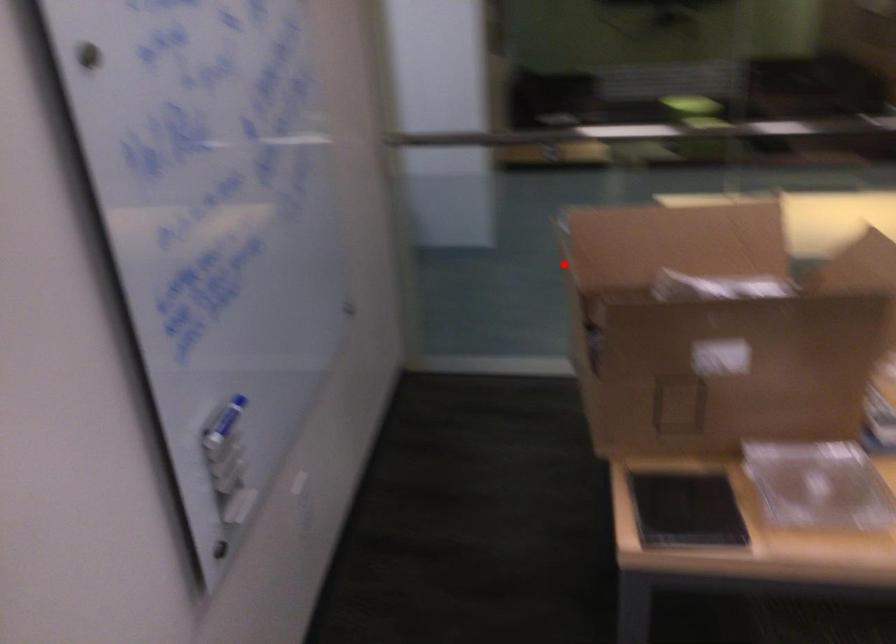
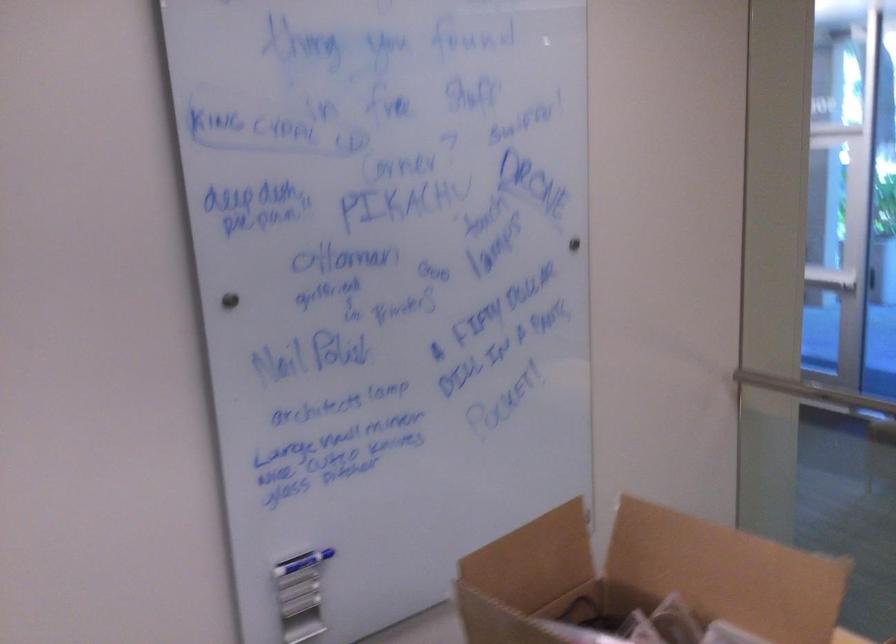
Where in the second image is the point corresponding to the highlighted location from the first image?

(536, 547)